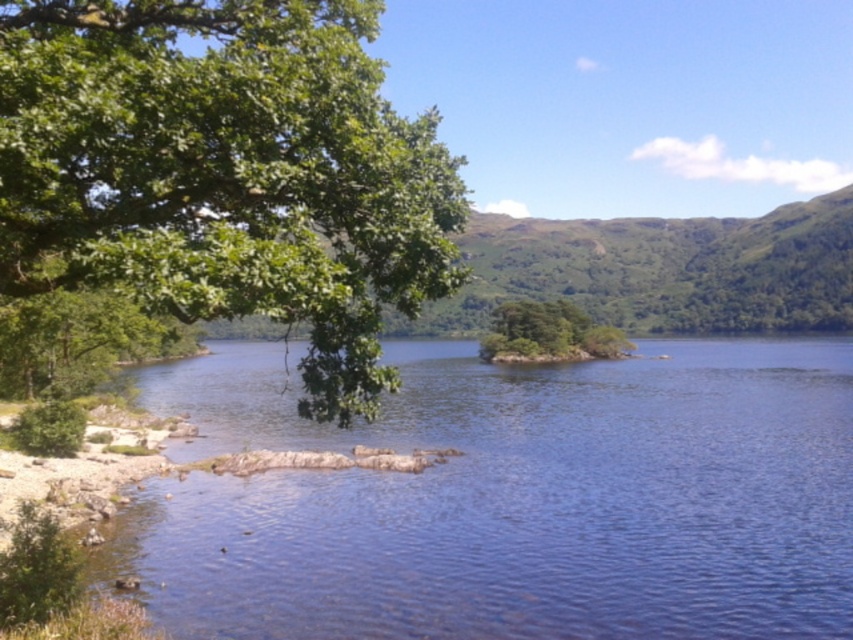
You are a kayaker planning to navigate through the clear water at lower left and the green leafy island at center. Which area requires more space for your kayak to maneuver safely?

The clear water at lower left requires more space for your kayak to maneuver safely since it has a larger size compared to the green leafy island at center.

You are an environmental scientist assessing the ecological health of the area. You observe the green leafy tree at upper left and the green leafy island at center. Which of these two has a larger size based on their visual appearance in the image?

The green leafy island at center is larger than the green leafy tree at upper left.

You are standing at the lakeshore and want to reach the green leafy island at center. Which direction should you head towards from the clear water at lower left?

The clear water at lower left is in front of the green leafy island at center, so you should head towards the center of the lake from the clear water at lower left to reach the island.